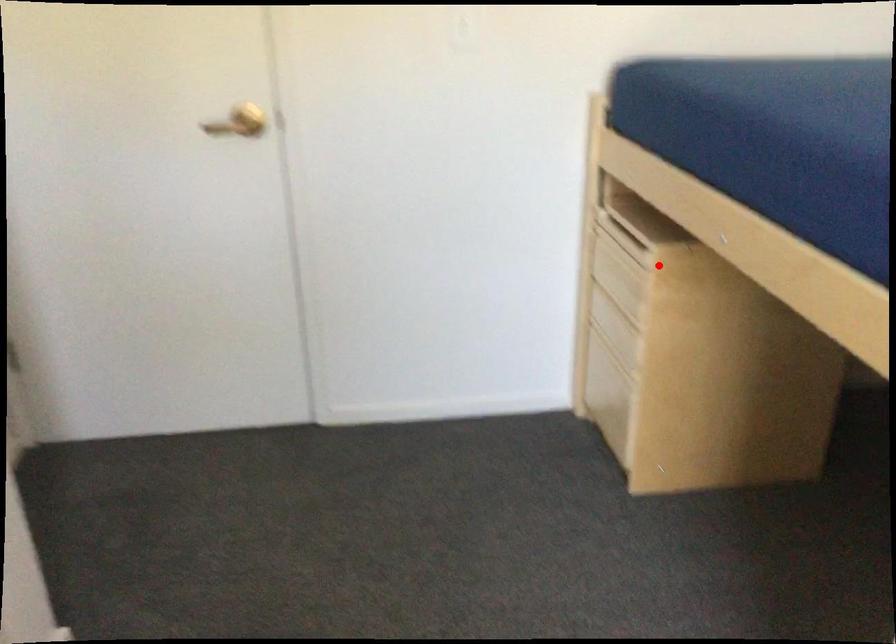
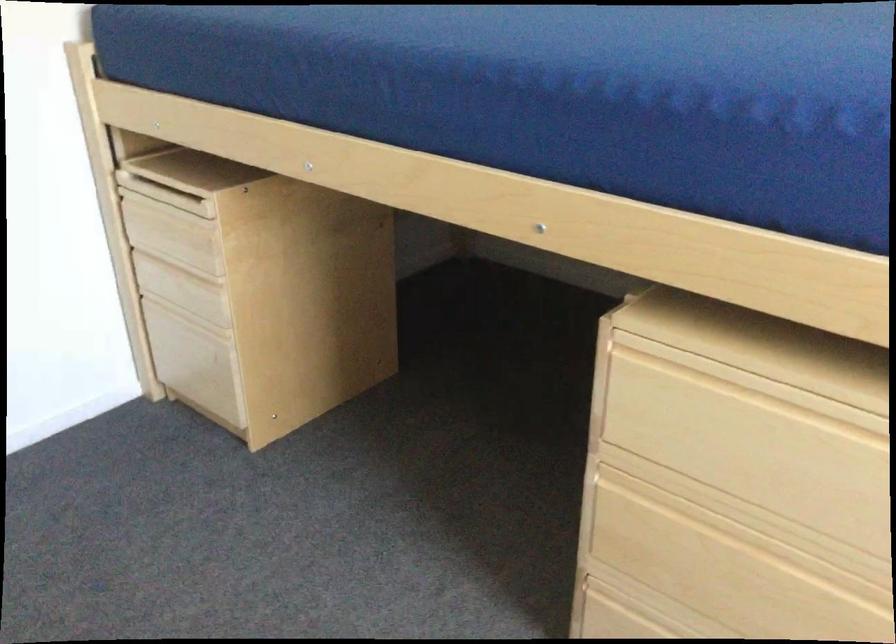
Where in the second image is the point corresponding to the highlighted location from the first image?

(220, 214)